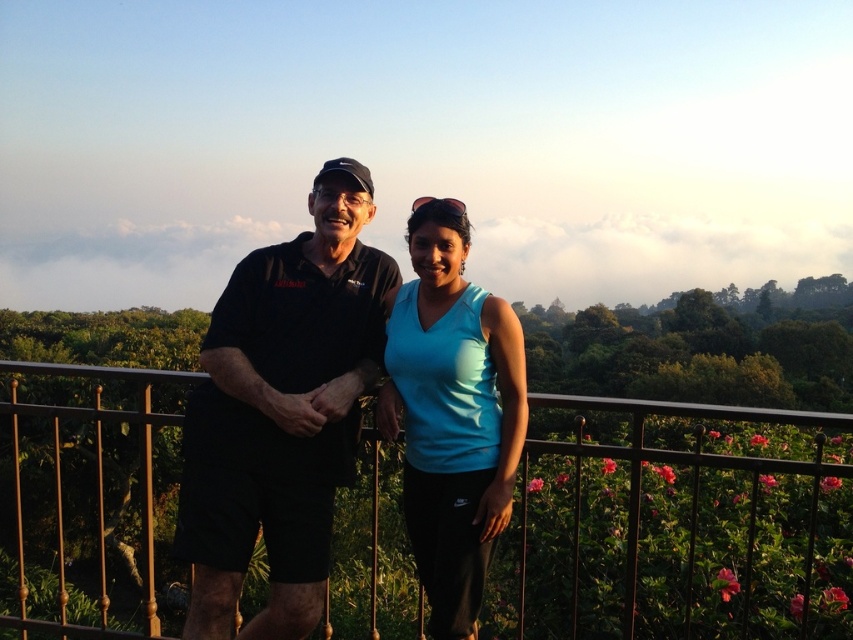
Question: Which of the following is the farthest from the observer?

Choices:
 (A) (102, 381)
 (B) (445, 522)

Answer: (A)

Question: Is metallic brown railing at center to the left of black fabric shirt at left from the viewer's perspective?

Choices:
 (A) yes
 (B) no

Answer: (B)

Question: Based on their relative distances, which object is nearer to the black fabric shirt at left?

Choices:
 (A) metallic brown railing at center
 (B) light blue fabric tank top at center

Answer: (B)

Question: Considering the relative positions of metallic brown railing at center and light blue fabric tank top at center in the image provided, where is metallic brown railing at center located with respect to light blue fabric tank top at center?

Choices:
 (A) above
 (B) below

Answer: (B)

Question: Can you confirm if metallic brown railing at center is wider than light blue fabric tank top at center?

Choices:
 (A) no
 (B) yes

Answer: (B)

Question: Which point appears farthest from the camera in this image?

Choices:
 (A) (447, 528)
 (B) (253, 250)

Answer: (B)